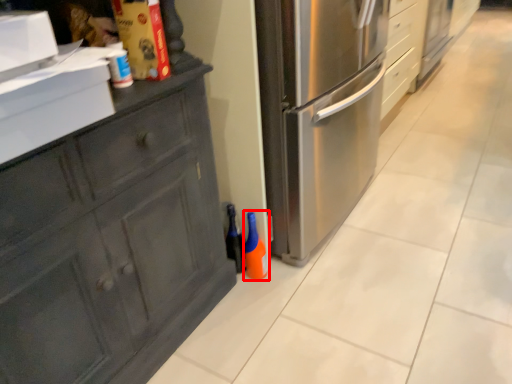
Question: From the image's perspective, what is the correct spatial positioning of bottle (annotated by the red box) in reference to bottle?

Choices:
 (A) above
 (B) below

Answer: (B)